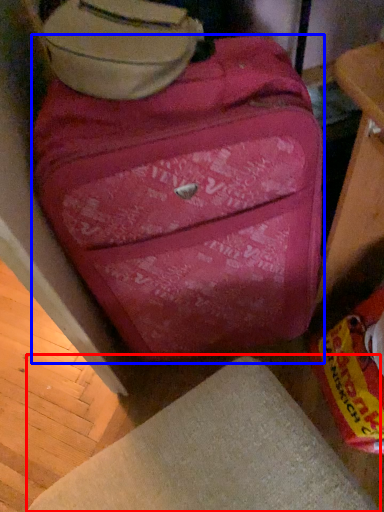
Question: Which point is further to the camera, furniture (highlighted by a red box) or suitcase (highlighted by a blue box)?

Choices:
 (A) furniture
 (B) suitcase

Answer: (B)